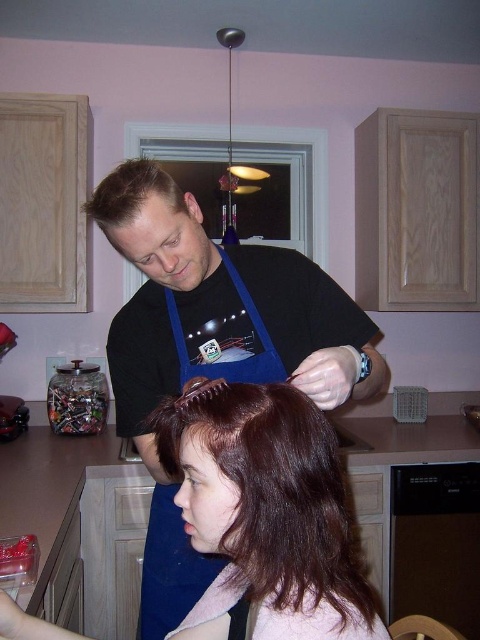
In the scene shown: Can you confirm if dark brown silky hair at lower center is positioned to the left of blue fabric apron at center?

No, dark brown silky hair at lower center is not to the left of blue fabric apron at center.

Based on the photo, measure the distance between dark brown silky hair at lower center and camera.

dark brown silky hair at lower center is 24.38 inches from camera.

Identify the location of dark brown silky hair at lower center. This screenshot has width=480, height=640. (267, 500).

Image resolution: width=480 pixels, height=640 pixels. In order to click on blue apron at center in this screenshot , I will do `click(212, 346)`.

Does blue apron at center have a smaller size compared to blue fabric apron at center?

No, blue apron at center is not smaller than blue fabric apron at center.

Does point (118, 392) lie in front of point (168, 563)?

Yes, it is.

This screenshot has width=480, height=640. Identify the location of blue apron at center. (212, 346).

The image size is (480, 640). Describe the element at coordinates (212, 346) in the screenshot. I see `blue apron at center` at that location.

What do you see at coordinates (212, 346) in the screenshot?
I see `blue apron at center` at bounding box center [212, 346].

Identify the location of blue apron at center. (212, 346).